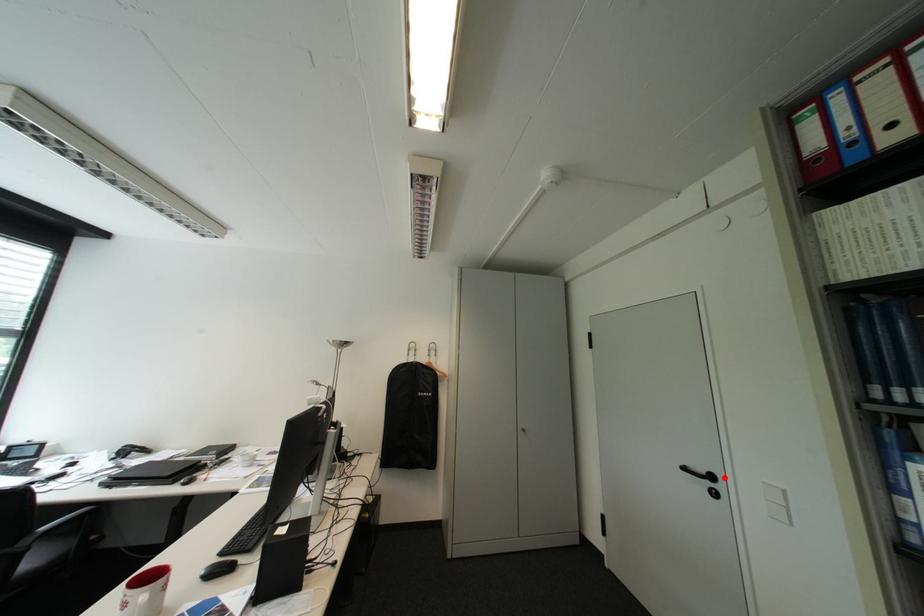
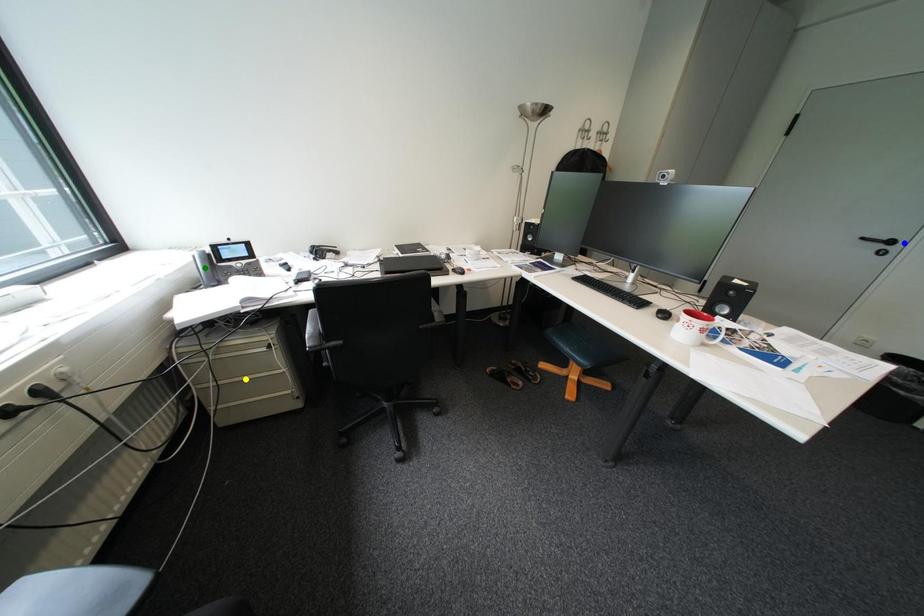
Question: I am providing you with two images of the same scene from different viewpoints. A red point is marked on the first image. You are given multiple points on the second image. Which spot in image 2 lines up with the point in image 1?

Choices:
 (A) yellow point
 (B) blue point
 (C) green point

Answer: (B)